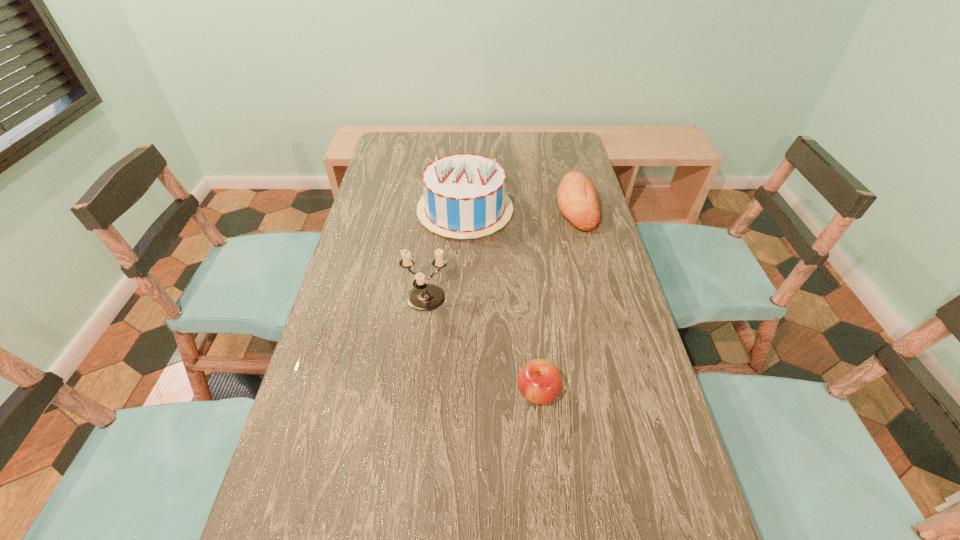
Locate an element on the screen. The width and height of the screenshot is (960, 540). birthday cake is located at coordinates (464, 197).

Identify the location of the third shortest object. (424, 297).

In order to click on candle holder in this screenshot , I will do `click(424, 297)`.

At what (x,y) coordinates should I click in order to perform the action: click on apple. Please return your answer as a coordinate pair (x, y). This screenshot has width=960, height=540. Looking at the image, I should click on (539, 381).

Locate an element on the screen. This screenshot has width=960, height=540. the rightmost object is located at coordinates (578, 201).

Where is `blank area located on the front of the birthday cake`? This screenshot has width=960, height=540. blank area located on the front of the birthday cake is located at coordinates (463, 256).

Find the location of `vacant region located on the back of the candle holder`. vacant region located on the back of the candle holder is located at coordinates (437, 206).

Locate an element on the screen. Image resolution: width=960 pixels, height=540 pixels. free location located 0.060m on the back of the apple is located at coordinates (534, 353).

I want to click on vacant space situated on the back of the rightmost object, so click(x=564, y=160).

Locate an element on the screen. object located in the right edge section of the desktop is located at coordinates (578, 201).